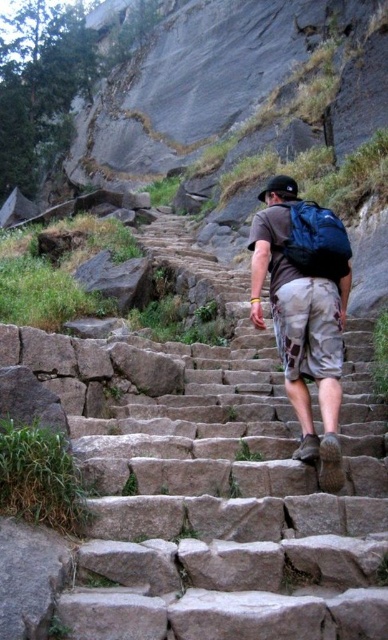
You are a drone operator trying to capture a photo of the gray stone stairs at center from above. Based on the scene description, what are the coordinates where you should position the drone to ensure the stairs are centered in the frame?

The coordinates to position the drone for the gray stone stairs at center are at point (202, 483).

You are a photographer trying to capture the hiker in the scene. You want to ensure that both the camouflage shorts at center and the matte blue backpack at upper center are clearly visible in your shot. Given their sizes, which object should you focus on to ensure both are in frame without needing to adjust your camera angle?

The camouflage shorts at center is bigger than the matte blue backpack at upper center, so focusing on the camouflage shorts at center will ensure both are visible without needing to adjust the camera angle since it occupies more space in the frame.

You are the hiker in the image. You want to place your matte blue backpack at upper center on the ground near the gray stone stairs at center. Is the backpack currently in a position where you can easily reach it without moving from where you are standing?

The gray stone stairs at center is in front of matte blue backpack at upper center, meaning the backpack is behind the stairs from your perspective. Therefore, you cannot easily reach it without moving as it is obstructed by the stairs.